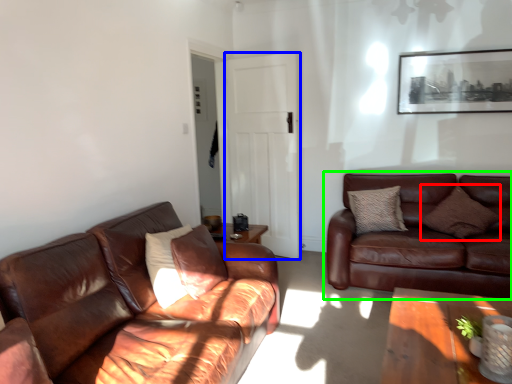
Question: Which object is the closest to the pillow (highlighted by a red box)? Choose among these: glass door (highlighted by a blue box) or studio couch (highlighted by a green box).

Choices:
 (A) glass door
 (B) studio couch

Answer: (B)